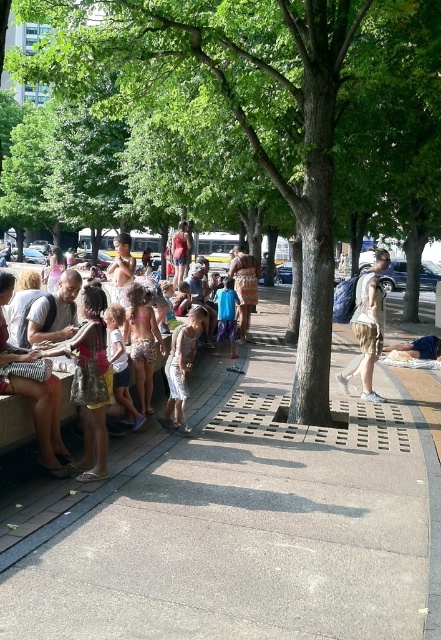
Question: Which point is farther to the camera?

Choices:
 (A) light brown fabric backpack at center
 (B) matte white shirt at center
 (C) matte pink dress at center

Answer: (C)

Question: Considering the real-world distances, which object is farthest from the matte white shirt at center?

Choices:
 (A) concrete at center
 (B) light brown fabric backpack at center

Answer: (A)

Question: Is green leafy tree at center smaller than matte pink dress at center?

Choices:
 (A) no
 (B) yes

Answer: (A)

Question: Does white cotton dress at center have a greater width compared to patterned fabric dress at center?

Choices:
 (A) yes
 (B) no

Answer: (B)

Question: Which point is farther to the camera?

Choices:
 (A) matte pink dress at center
 (B) patterned fabric dress at center
 (C) light brown fabric backpack at center

Answer: (A)

Question: Does concrete at center have a greater width compared to matte pink dress at center?

Choices:
 (A) yes
 (B) no

Answer: (B)